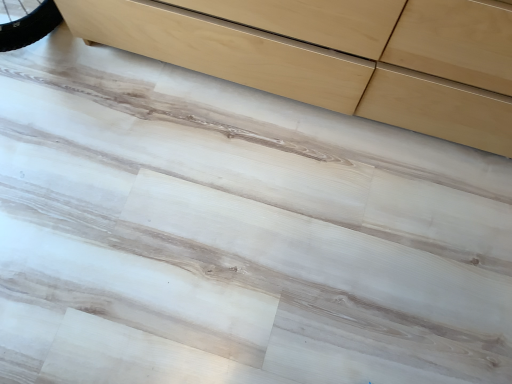
Image resolution: width=512 pixels, height=384 pixels. Describe the element at coordinates (335, 55) in the screenshot. I see `light wood chest of drawers at upper center` at that location.

At what (x,y) coordinates should I click in order to perform the action: click on light wood chest of drawers at upper center. Please return your answer as a coordinate pair (x, y). The height and width of the screenshot is (384, 512). Looking at the image, I should click on click(x=335, y=55).

The width and height of the screenshot is (512, 384). I want to click on light wood chest of drawers at upper center, so click(335, 55).